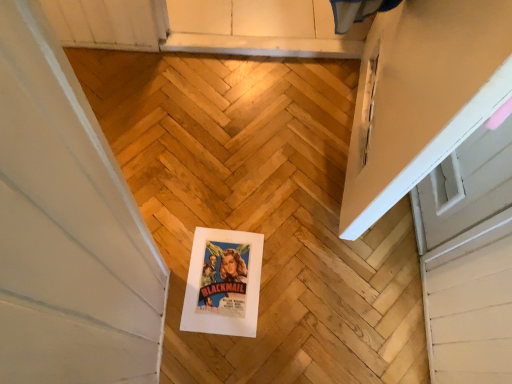
Find the location of a particular element. Image resolution: width=512 pixels, height=384 pixels. empty space that is to the right of matte paper poster at center is located at coordinates (301, 300).